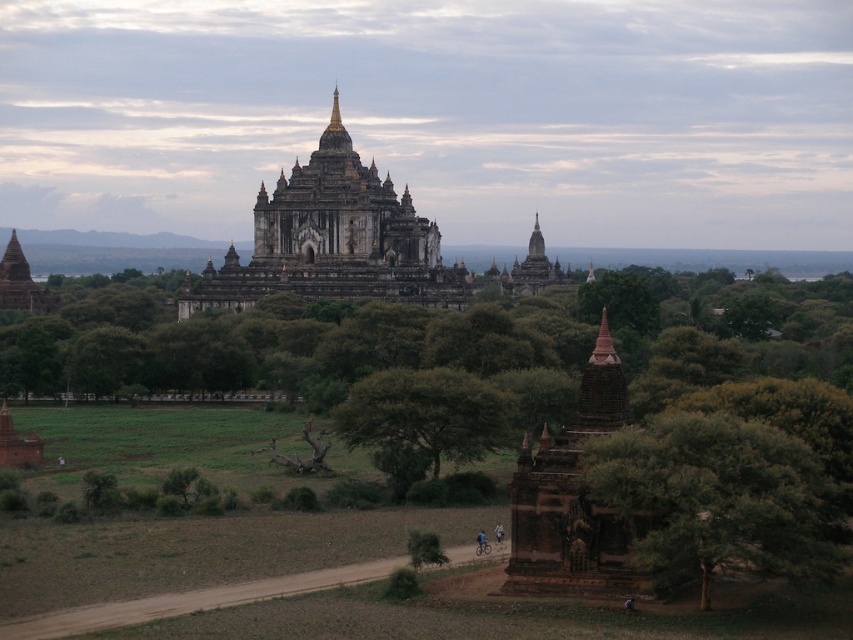
Question: Is green leafy tree at lower right to the right of green leafy tree at center from the viewer's perspective?

Choices:
 (A) yes
 (B) no

Answer: (A)

Question: Which of these objects is positioned closest to the stone temple at center?

Choices:
 (A) brown stone temple at lower right
 (B) green leafy tree at center

Answer: (B)

Question: Is brown stone temple at lower right below green leafy tree at center?

Choices:
 (A) no
 (B) yes

Answer: (A)

Question: Which is farther from the green leafy tree at lower right?

Choices:
 (A) green leafy tree at center
 (B) stone temple at center
 (C) brown stone temple at lower right

Answer: (B)

Question: Is brown stone temple at lower right to the right of green leafy tree at center from the viewer's perspective?

Choices:
 (A) no
 (B) yes

Answer: (B)

Question: Which point is farther from the camera taking this photo?

Choices:
 (A) (599, 580)
 (B) (358, 225)
 (C) (367, 376)

Answer: (B)